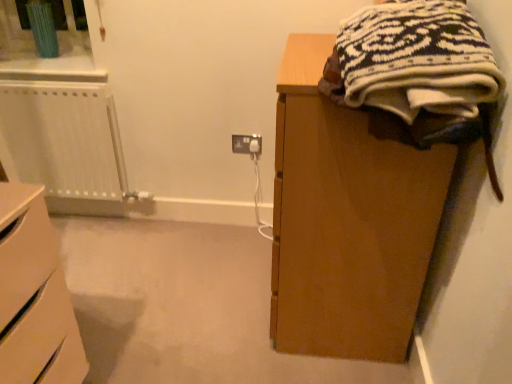
In order to face white matte chest of drawers at lower left, should I rotate leftwards or rightwards?

A 32.465 degree turn to the left will do.

Describe the element at coordinates (417, 59) in the screenshot. The image size is (512, 384). I see `knitted wool sweater at upper right` at that location.

The image size is (512, 384). In order to click on matte white socket at center in this screenshot , I will do `click(246, 144)`.

How many degrees apart are the facing directions of matte white socket at center and white matte chest of drawers at lower left?

91.5 degrees.

Is matte white socket at center in front of or behind white matte chest of drawers at lower left in the image?

In the image, matte white socket at center appears behind white matte chest of drawers at lower left.

Consider the image. Are matte white socket at center and white matte chest of drawers at lower left far apart?

Yes.

Based on the photo, is matte white socket at center thinner than white matte chest of drawers at lower left?

Yes.

Is white plastic radiator at left inside or outside of knitted wool sweater at upper right?

white plastic radiator at left exists outside the volume of knitted wool sweater at upper right.

Can you confirm if white plastic radiator at left is wider than knitted wool sweater at upper right?

Incorrect, the width of white plastic radiator at left does not surpass that of knitted wool sweater at upper right.

Could you tell me if white plastic radiator at left is turned towards knitted wool sweater at upper right?

No, white plastic radiator at left is not turned towards knitted wool sweater at upper right.

Based on the photo, from the image's perspective, is white plastic radiator at left located above or below knitted wool sweater at upper right?

white plastic radiator at left is situated lower than knitted wool sweater at upper right in the image.

In the scene shown: Is matte white socket at center looking in the opposite direction of white plastic radiator at left?

That's not correct — matte white socket at center is not looking away from white plastic radiator at left.

Visually, is matte white socket at center positioned to the left or to the right of white plastic radiator at left?

matte white socket at center is positioned on white plastic radiator at left's right side.

From the image's perspective, who appears lower, matte white socket at center or white plastic radiator at left?

matte white socket at center is shown below in the image.

Does matte white socket at center turn towards knitted wool sweater at upper right?

No.

Does matte white socket at center contain knitted wool sweater at upper right?

No, knitted wool sweater at upper right is not inside matte white socket at center.

Which point is more distant from viewer, (246, 153) or (422, 19)?

The point (246, 153) is farther from the camera.

How different are the orientations of matte white socket at center and knitted wool sweater at upper right in degrees?

There is a 87.7-degree angle between the facing directions of matte white socket at center and knitted wool sweater at upper right.

Considering the positions of objects white matte chest of drawers at lower left and white plastic radiator at left in the image provided, who is more to the right, white matte chest of drawers at lower left or white plastic radiator at left?

white matte chest of drawers at lower left is more to the right.

In the image, is white matte chest of drawers at lower left positioned in front of or behind white plastic radiator at left?

In the image, white matte chest of drawers at lower left appears in front of white plastic radiator at left.

How much distance is there between white matte chest of drawers at lower left and white plastic radiator at left?

They are 3.81 feet apart.

From the image's perspective, between white matte chest of drawers at lower left and knitted wool sweater at upper right, who is located below?

white matte chest of drawers at lower left.

Can you confirm if white matte chest of drawers at lower left is shorter than knitted wool sweater at upper right?

Incorrect, the height of white matte chest of drawers at lower left does not fall short of that of knitted wool sweater at upper right.

Does white matte chest of drawers at lower left appear on the left side of knitted wool sweater at upper right?

Indeed, white matte chest of drawers at lower left is positioned on the left side of knitted wool sweater at upper right.

Relative to knitted wool sweater at upper right, is white matte chest of drawers at lower left in front or behind?

In the image, white matte chest of drawers at lower left appears behind knitted wool sweater at upper right.

Is matte white socket at center completely or partially inside white plastic radiator at left?

No, matte white socket at center is located outside of white plastic radiator at left.

From a real-world perspective, who is located higher, white plastic radiator at left or matte white socket at center?

matte white socket at center is physically above.

Looking at this image, who is bigger, white plastic radiator at left or matte white socket at center?

white plastic radiator at left.

Can you confirm if white plastic radiator at left is wider than matte white socket at center?

Yes.

Identify the location of the chest of drawers that is under the matte white socket at center (from a real-world perspective). This screenshot has height=384, width=512. (34, 296).

In order to click on radiator to the left of knitted wool sweater at upper right in this screenshot , I will do `click(64, 144)`.

From the image, which object appears to be farther from knitted wool sweater at upper right, white matte chest of drawers at lower left or matte white socket at center?

matte white socket at center is positioned further to the anchor knitted wool sweater at upper right.

Considering their positions, is knitted wool sweater at upper right positioned further to white plastic radiator at left than matte white socket at center?

knitted wool sweater at upper right is positioned further to the anchor white plastic radiator at left.

Considering their positions, is white plastic radiator at left positioned closer to knitted wool sweater at upper right than matte white socket at center?

matte white socket at center lies closer to knitted wool sweater at upper right than the other object.

When comparing their distances from white matte chest of drawers at lower left, does white plastic radiator at left or matte white socket at center seem further?

Based on the image, matte white socket at center appears to be further to white matte chest of drawers at lower left.

Which object lies further to the anchor point white plastic radiator at left, matte white socket at center or knitted wool sweater at upper right?

knitted wool sweater at upper right is positioned further to the anchor white plastic radiator at left.

From the picture: From the image, which object appears to be nearer to knitted wool sweater at upper right, matte white socket at center or white matte chest of drawers at lower left?

white matte chest of drawers at lower left is closer to knitted wool sweater at upper right.

Estimate the real-world distances between objects in this image. Which object is further from matte white socket at center, knitted wool sweater at upper right or white plastic radiator at left?

knitted wool sweater at upper right is further to matte white socket at center.

Which object lies further to the anchor point white plastic radiator at left, white matte chest of drawers at lower left or knitted wool sweater at upper right?

knitted wool sweater at upper right.

Locate an element on the screen. chest of drawers between knitted wool sweater at upper right and matte white socket at center in the front-back direction is located at coordinates (34, 296).

Identify the location of radiator located between knitted wool sweater at upper right and matte white socket at center in the depth direction. (x=64, y=144).

Locate an element on the screen. The height and width of the screenshot is (384, 512). the chest of drawers situated between white plastic radiator at left and knitted wool sweater at upper right from left to right is located at coordinates (34, 296).

Where is `radiator between white matte chest of drawers at lower left and matte white socket at center in the front-back direction`? The image size is (512, 384). radiator between white matte chest of drawers at lower left and matte white socket at center in the front-back direction is located at coordinates (64, 144).